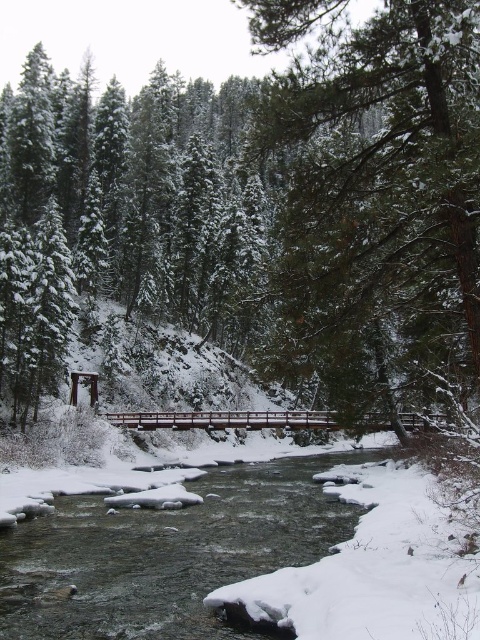
You are an explorer trying to cross the river. You see the green textured tree at center and the white snowy stream at center. Which object would you choose to step on to cross the river?

The white snowy stream at center is the better choice to step on to cross the river because the green textured tree at center is larger in size and might not be stable enough for walking on.

Looking at this image, you are standing on the wooden bridge and want to walk to the green textured tree at center. Which direction should you go relative to the white snowy stream at center?

The green textured tree at center is positioned on the right side of the white snowy stream at center, so you should head towards the right side of the white snowy stream at center to reach it.